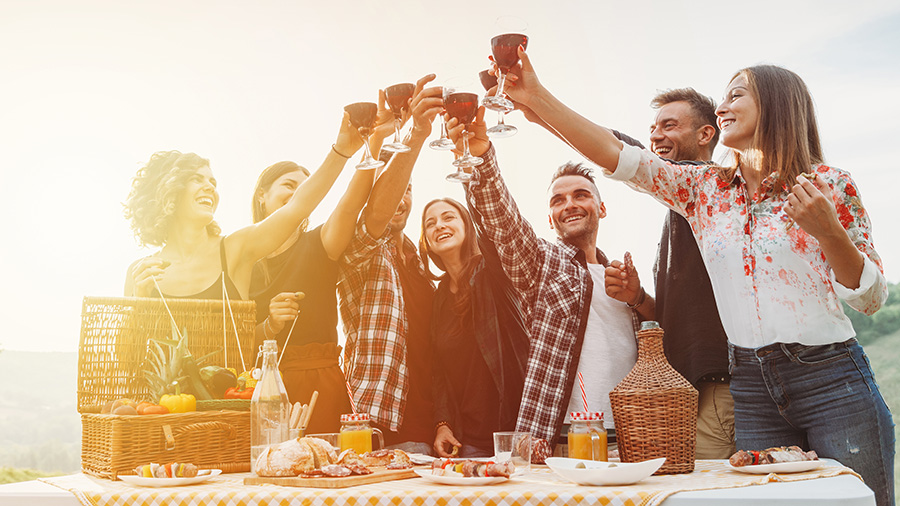
Locate an element on the screen. 5 wine glasses is located at coordinates (357, 107), (402, 89), (455, 106), (486, 76), (501, 55).